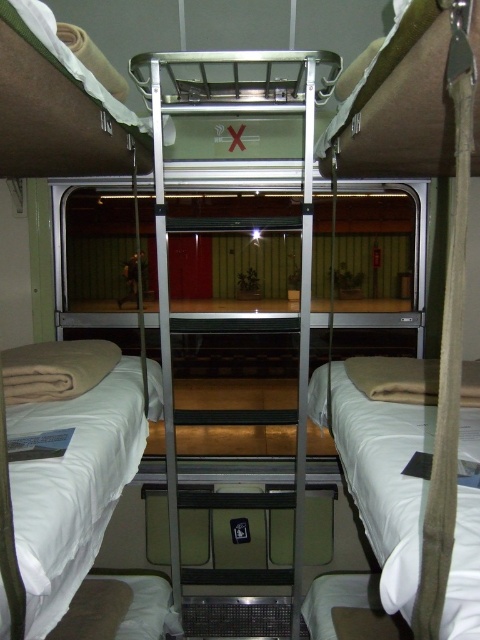
Does white soft bedding at lower right come in front of white soft pillow at lower left?

Yes, white soft bedding at lower right is in front of white soft pillow at lower left.

Is white soft bedding at lower right to the left of white soft pillow at lower left from the viewer's perspective?

Incorrect, white soft bedding at lower right is not on the left side of white soft pillow at lower left.

I want to click on white soft bedding at lower right, so click(384, 481).

How distant is metallic silver bunk bed at center from white soft bedding at lower left?

The distance of metallic silver bunk bed at center from white soft bedding at lower left is 21.98 inches.

Is metallic silver bunk bed at center below white soft bedding at lower left?

Actually, metallic silver bunk bed at center is above white soft bedding at lower left.

This screenshot has width=480, height=640. What do you see at coordinates (238, 310) in the screenshot?
I see `metallic silver bunk bed at center` at bounding box center [238, 310].

At what (x,y) coordinates should I click in order to perform the action: click on metallic silver bunk bed at center. Please return your answer as a coordinate pair (x, y). This screenshot has width=480, height=640. Looking at the image, I should click on (238, 310).

Between white soft bedding at lower left and white soft pillow at lower left, which one has more height?

Standing taller between the two is white soft bedding at lower left.

Locate an element on the screen. Image resolution: width=480 pixels, height=640 pixels. white soft bedding at lower left is located at coordinates click(x=72, y=486).